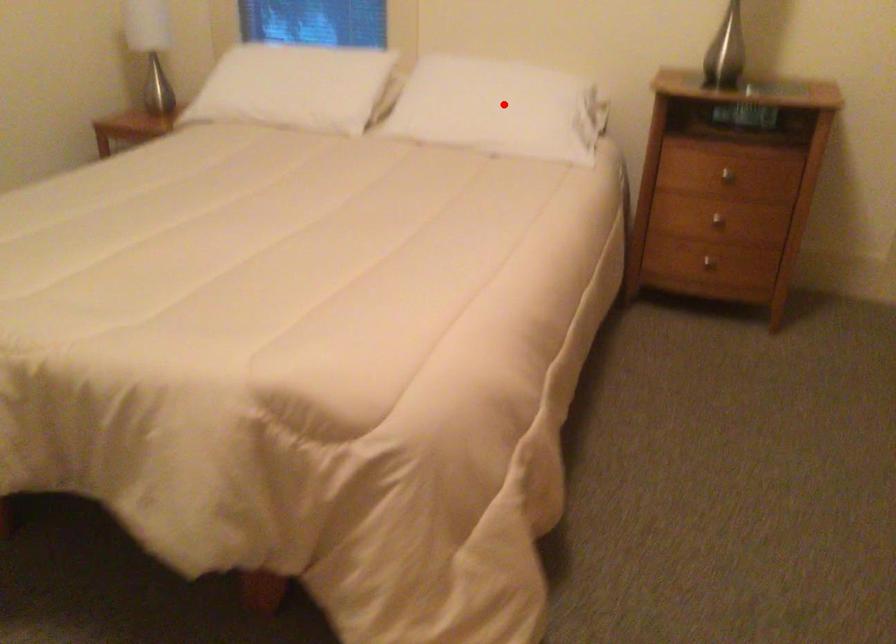
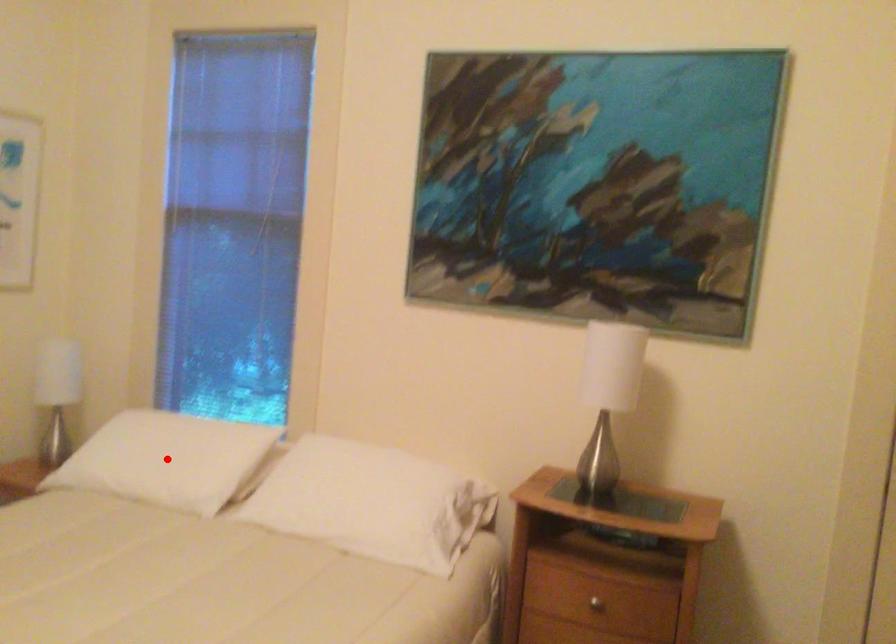
I am providing you with two images of the same scene from different viewpoints. A red point is marked on the first image and another point is marked on the second image. Are the points marked in image1 and image2 representing the same 3D position?

No